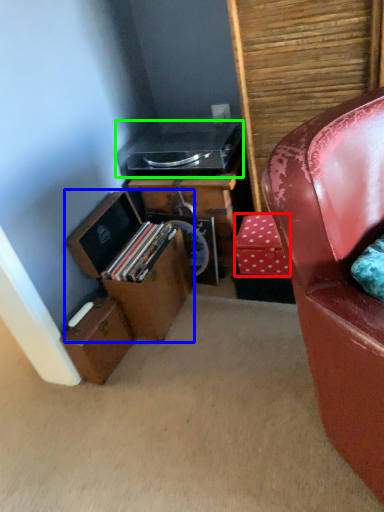
Question: Which object is the closest to the cardboard box (highlighted by a red box)? Choose among these: box (highlighted by a blue box) or stereo (highlighted by a green box).

Choices:
 (A) box
 (B) stereo

Answer: (A)